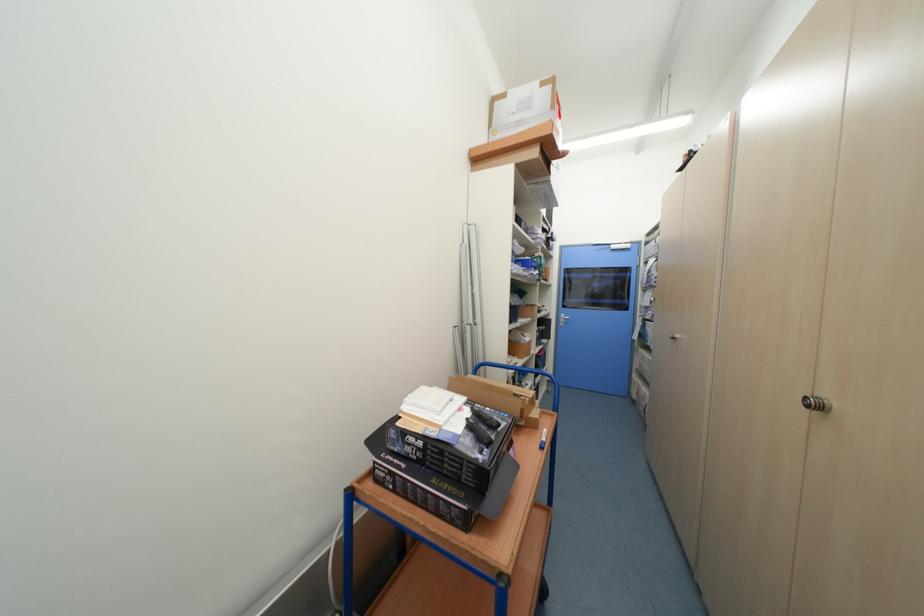
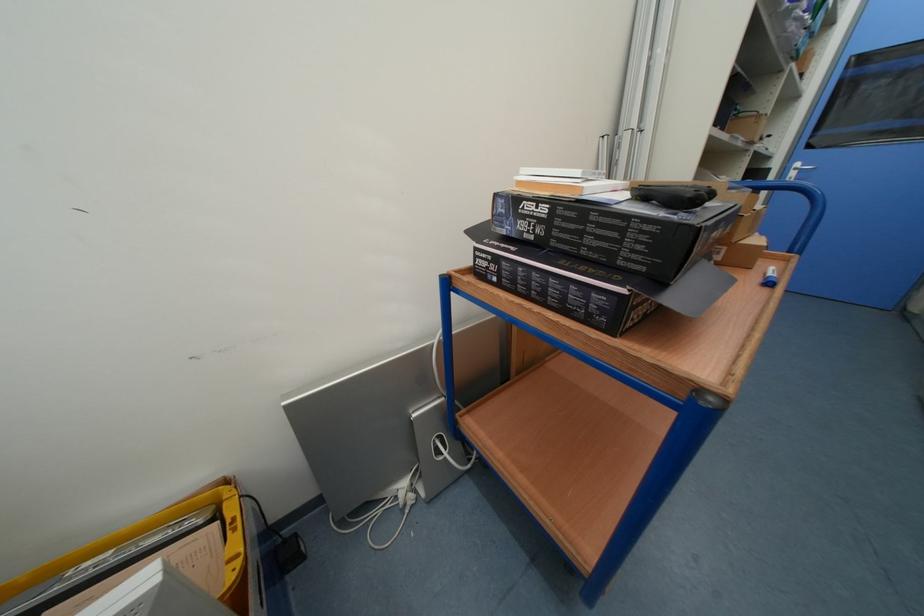
The point at (397, 474) is marked in the first image. Where is the corresponding point in the second image?

(502, 261)